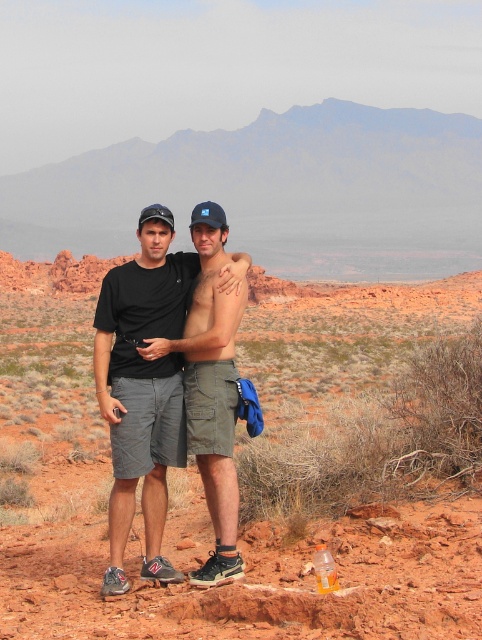
You are a hiker who wants to take a photo of the green cargo shorts at center and the rustic sandstone rock at center. Which object should you focus on first if you want to capture both in the same frame without moving the camera?

You should focus on the green cargo shorts at center first because the rustic sandstone rock at center is positioned to the right of it, so keeping the shorts centered will allow the rock to be included in the frame.